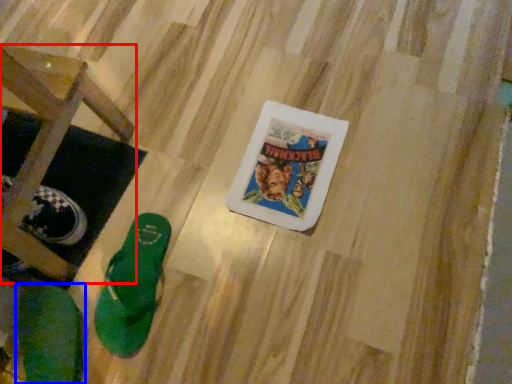
Question: Which of the following is the closest to the observer, furniture (highlighted by a red box) or footwear (highlighted by a blue box)?

Choices:
 (A) furniture
 (B) footwear

Answer: (A)